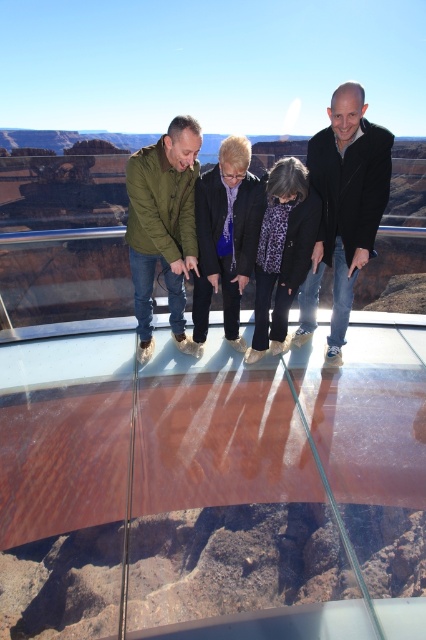
You are standing on the glass floor and want to place a small souvenir between the purple fabric at center and the leopard print coat at center. Which object should you place it closer to to ensure it fits within the space between them?

The purple fabric at center is wider than the leopard print coat at center. To ensure the souvenir fits within the space between them, place it closer to the leopard print coat at center since the purple fabric at center occupies more width.

You are a tour guide explaining the glass floor to visitors. You notice the black matte jacket at center and the green matte jacket at left. Which jacket takes up more space on the glass floor?

The green matte jacket at left occupies more space than the black matte jacket at center.

You are standing on the glass floor overlooking the canyon. You see the green matte jacket at left and the purple fabric at center. Which one is positioned more to the left side?

The green matte jacket at left is positioned more to the left side than the purple fabric at center.